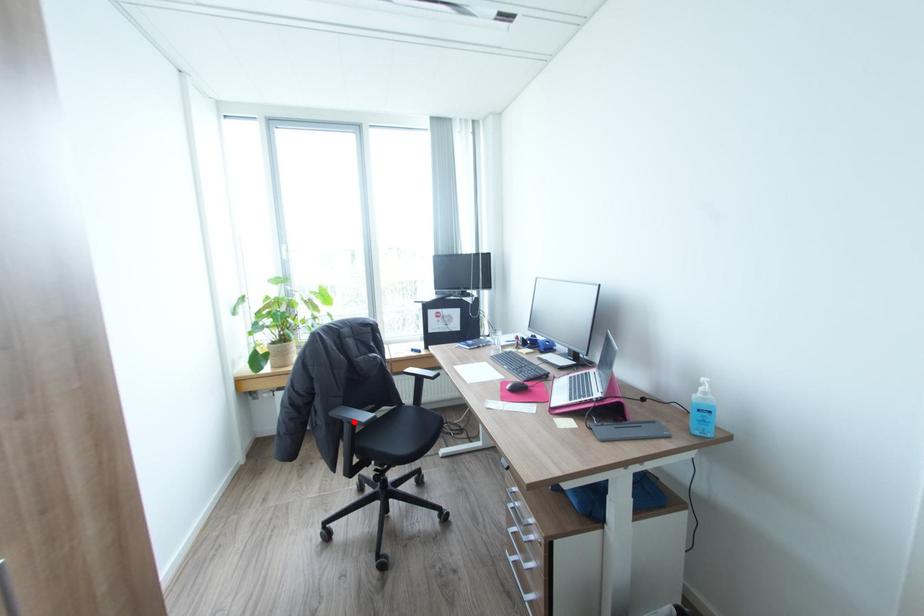
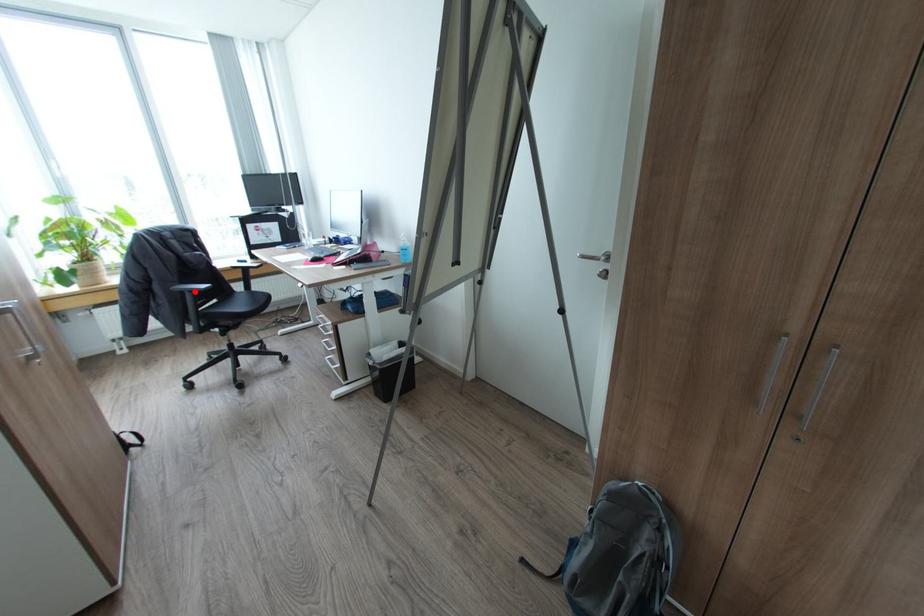
I am providing you with two images of the same scene from different viewpoints. A red point is marked on the first image and another point is marked on the second image. Are the points marked in image1 and image2 representing the same 3D position?

Yes